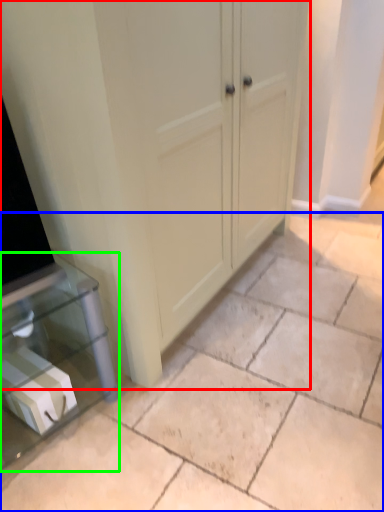
Question: Which is nearer to the cupboard (highlighted by a red box)? concrete (highlighted by a blue box) or furniture (highlighted by a green box).

Choices:
 (A) concrete
 (B) furniture

Answer: (B)